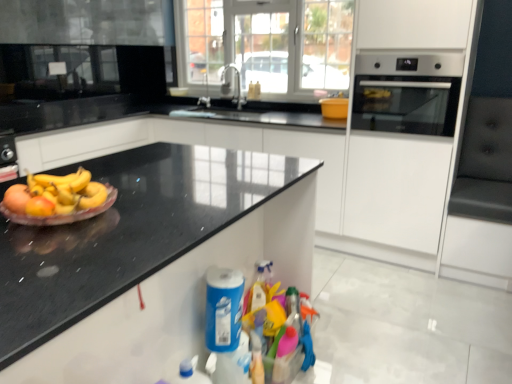
Question: Considering the relative positions of blue plastic cleaning product at lower center and satin nickel faucet at center in the image provided, is blue plastic cleaning product at lower center to the right of satin nickel faucet at center from the viewer's perspective?

Choices:
 (A) yes
 (B) no

Answer: (A)

Question: From a real-world perspective, is blue plastic cleaning product at lower center positioned over satin nickel faucet at center based on gravity?

Choices:
 (A) no
 (B) yes

Answer: (A)

Question: From a real-world perspective, is blue plastic cleaning product at lower center physically below satin nickel faucet at center?

Choices:
 (A) no
 (B) yes

Answer: (B)

Question: Can you confirm if blue plastic cleaning product at lower center is positioned to the left of satin nickel faucet at center?

Choices:
 (A) no
 (B) yes

Answer: (A)

Question: Considering the relative sizes of blue plastic cleaning product at lower center and satin nickel faucet at center in the image provided, is blue plastic cleaning product at lower center wider than satin nickel faucet at center?

Choices:
 (A) yes
 (B) no

Answer: (B)

Question: Considering the positions of blue plastic cleaning product at lower center and silver metallic faucet at upper center in the image, is blue plastic cleaning product at lower center taller or shorter than silver metallic faucet at upper center?

Choices:
 (A) short
 (B) tall

Answer: (B)

Question: Is point 228,367 closer or farther from the camera than point 206,89?

Choices:
 (A) farther
 (B) closer

Answer: (B)

Question: From a real-world perspective, relative to silver metallic faucet at upper center, is blue plastic cleaning product at lower center vertically above or below?

Choices:
 (A) below
 (B) above

Answer: (A)

Question: From the image's perspective, is blue plastic cleaning product at lower center above or below silver metallic faucet at upper center?

Choices:
 (A) below
 (B) above

Answer: (A)

Question: Is black granite countertop at left to the left or to the right of satin nickel faucet at center in the image?

Choices:
 (A) right
 (B) left

Answer: (B)

Question: From a real-world perspective, is black granite countertop at left physically located above or below satin nickel faucet at center?

Choices:
 (A) below
 (B) above

Answer: (A)

Question: Is point (97, 307) closer or farther from the camera than point (233, 69)?

Choices:
 (A) closer
 (B) farther

Answer: (A)

Question: Looking at their shapes, would you say black granite countertop at left is wider or thinner than satin nickel faucet at center?

Choices:
 (A) thin
 (B) wide

Answer: (B)

Question: Does point (7, 215) appear closer or farther from the camera than point (226, 46)?

Choices:
 (A) farther
 (B) closer

Answer: (B)

Question: Would you say translucent plastic plate at left is to the left or to the right of transparent glass door at center in the picture?

Choices:
 (A) left
 (B) right

Answer: (A)